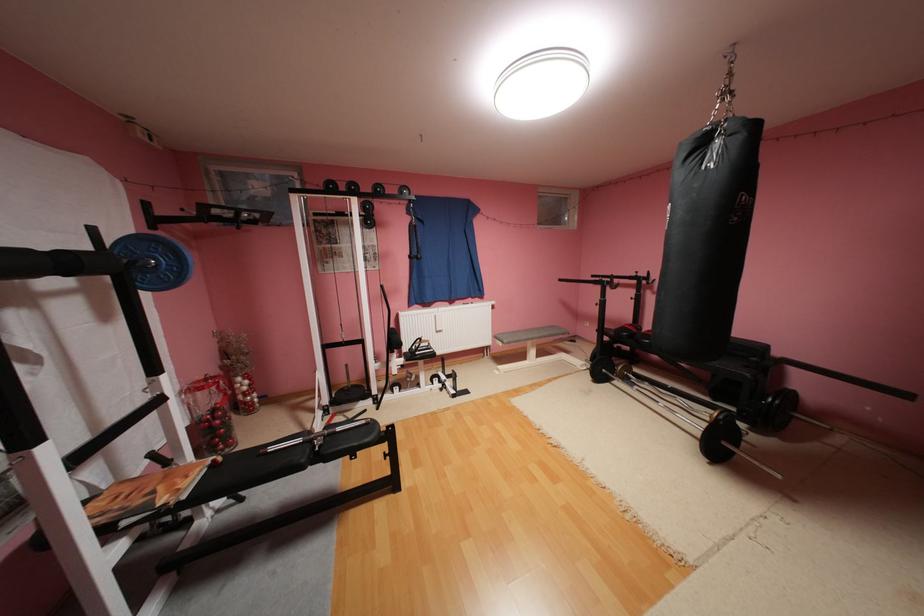
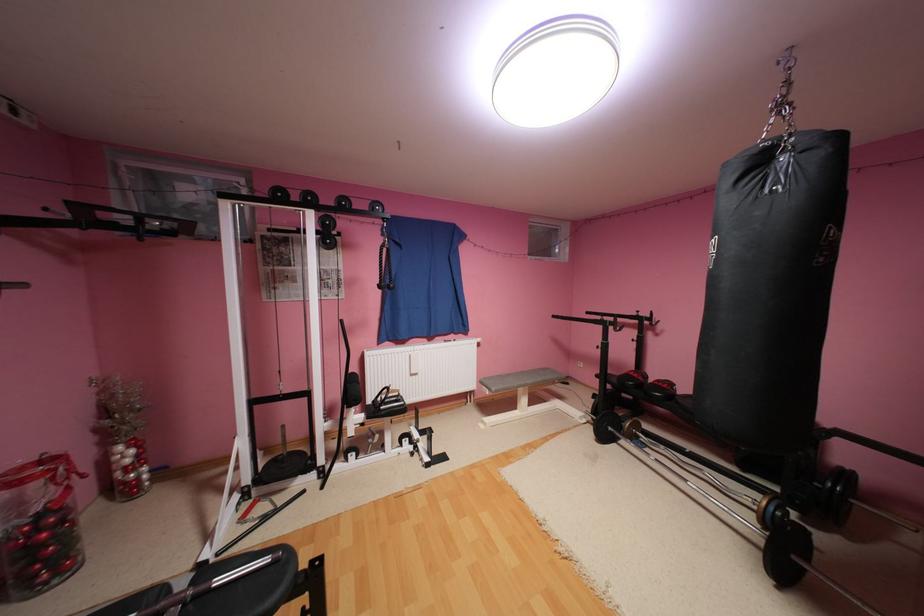
Where in the second image is the point corresponding to [593,368] from the first image?

(593, 419)